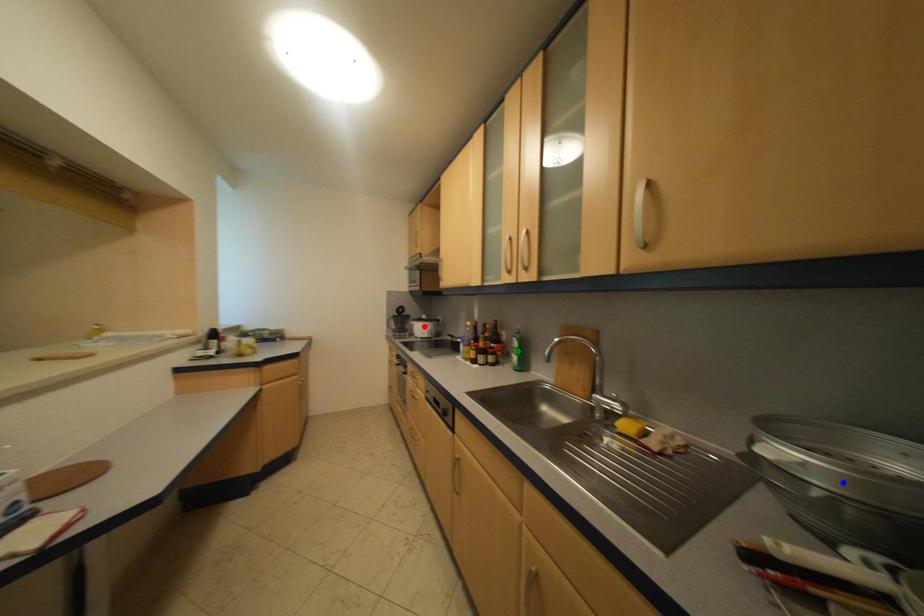
Order these from nearest to farthest:
blue point, green point, red point

1. blue point
2. green point
3. red point